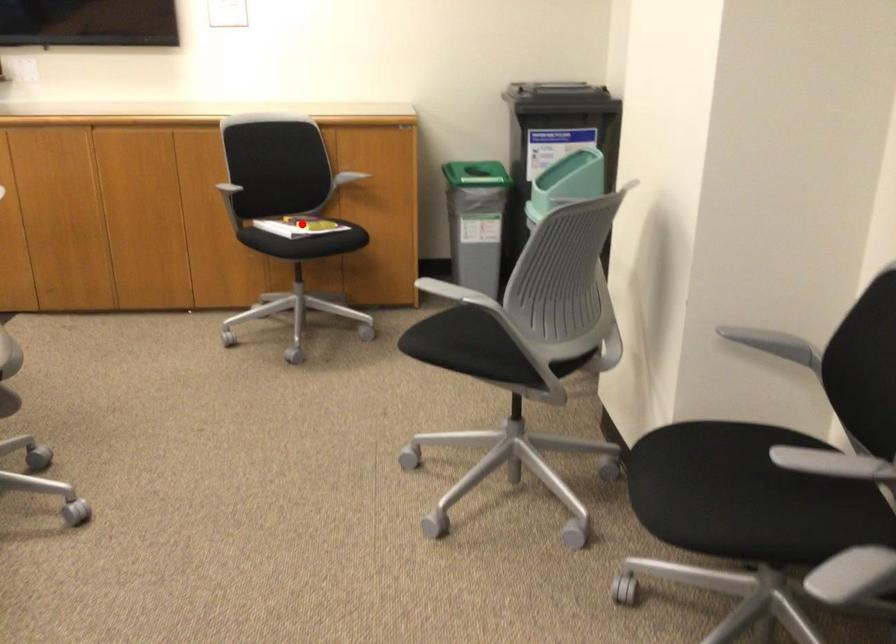
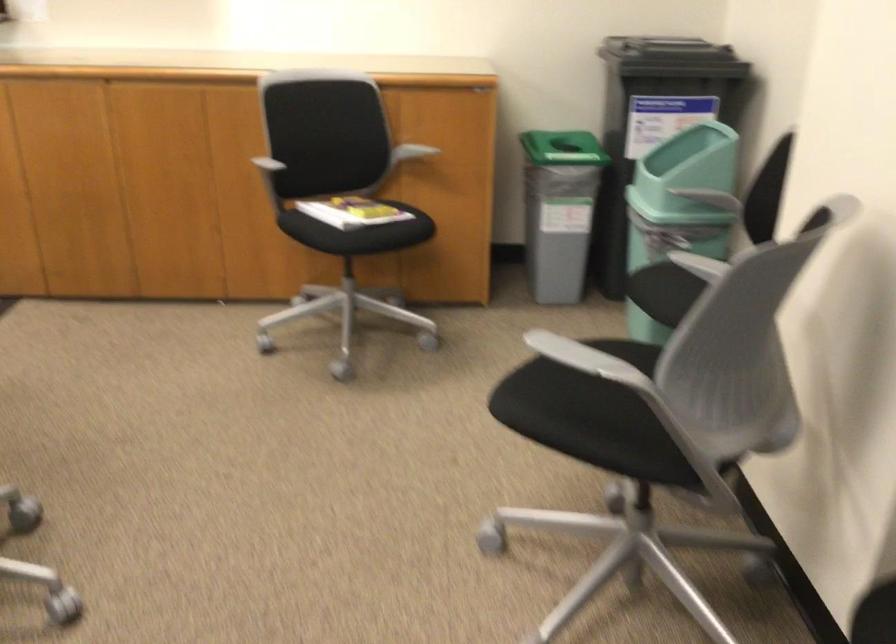
In the second image, find the point that corresponds to the highlighted location in the first image.

(355, 212)